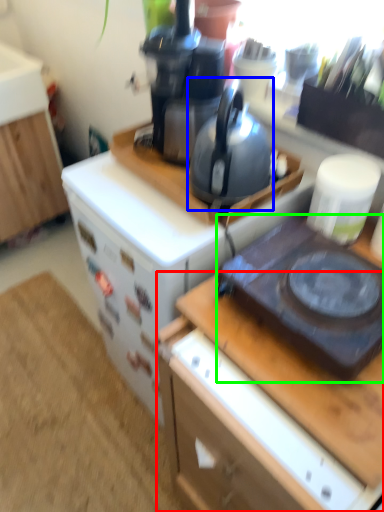
Question: Which is nearer to the desk (highlighted by a red box)? kettle (highlighted by a blue box) or gas stove (highlighted by a green box).

Choices:
 (A) kettle
 (B) gas stove

Answer: (B)